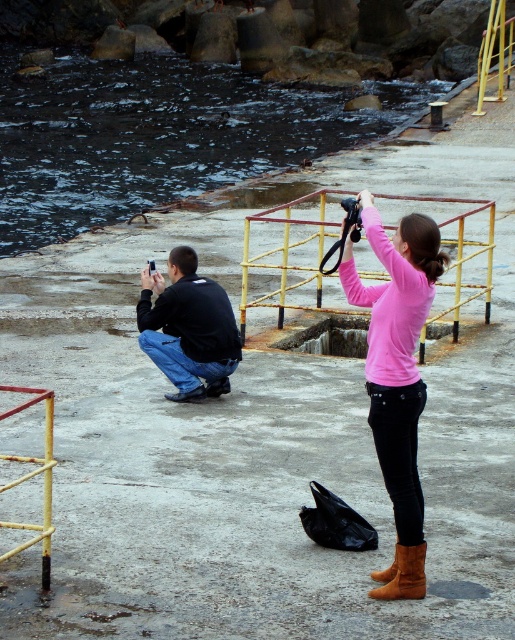
The height and width of the screenshot is (640, 515). What do you see at coordinates (397, 376) in the screenshot?
I see `pink matte sweater at center` at bounding box center [397, 376].

Does pink matte sweater at center have a greater width compared to black matte jacket at lower left?

In fact, pink matte sweater at center might be narrower than black matte jacket at lower left.

Is point (372, 360) farther from viewer compared to point (236, 342)?

No.

At what (x,y) coordinates should I click in order to perform the action: click on pink matte sweater at center. Please return your answer as a coordinate pair (x, y). Looking at the image, I should click on (397, 376).

Image resolution: width=515 pixels, height=640 pixels. What do you see at coordinates (290, 252) in the screenshot? I see `yellow metal railing at center` at bounding box center [290, 252].

Between yellow metal railing at center and brown suede boot at lower center, which one is positioned higher?

yellow metal railing at center is above.

Identify the location of yellow metal railing at center. This screenshot has height=640, width=515. (290, 252).

Is pink matte sweater at center to the right of brown suede boot at lower center from the viewer's perspective?

Incorrect, pink matte sweater at center is not on the right side of brown suede boot at lower center.

Which is more to the right, pink matte sweater at center or brown suede boot at lower center?

Positioned to the right is brown suede boot at lower center.

Is point (408, 355) closer to viewer compared to point (409, 564)?

No, it is behind (409, 564).

The image size is (515, 640). What are the coordinates of `pink matte sweater at center` in the screenshot? It's located at (397, 376).